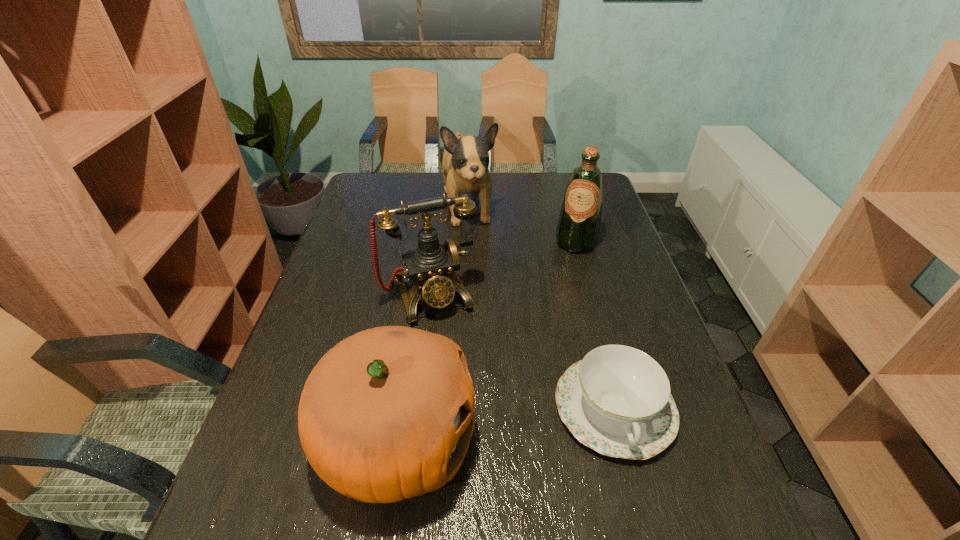
At what (x,y) coordinates should I click in order to perform the action: click on free space located on the front-facing side of the olive oil. Please return your answer as a coordinate pair (x, y). This screenshot has height=540, width=960. Looking at the image, I should click on (559, 294).

Identify the location of vacant space located 0.200m on the front-facing side of the olive oil. (558, 296).

Identify the location of free location located 0.240m on the front of the third farthest object, featuring the rotary dial. This screenshot has width=960, height=540. (473, 403).

What are the coordinates of `vacant space located 0.300m on the front of the third farthest object, featuring the rotary dial` in the screenshot? It's located at (483, 426).

Identify the location of vacant space located on the front of the third farthest object, featuring the rotary dial. (470, 395).

Where is `object present at the far edge`? This screenshot has width=960, height=540. object present at the far edge is located at coordinates 465,164.

At what (x,y) coordinates should I click in order to perform the action: click on pumpkin present at the near edge. Please return your answer as a coordinate pair (x, y). This screenshot has height=540, width=960. Looking at the image, I should click on (387, 414).

Image resolution: width=960 pixels, height=540 pixels. In order to click on chinaware situated at the near edge in this screenshot , I will do `click(617, 400)`.

The height and width of the screenshot is (540, 960). In order to click on object located in the left edge section of the desktop in this screenshot , I will do `click(387, 414)`.

Where is `chinaware present at the right edge`? The image size is (960, 540). chinaware present at the right edge is located at coordinates (617, 400).